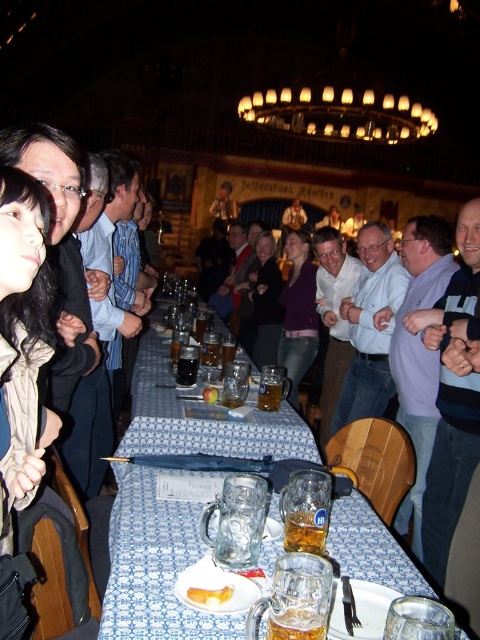
Question: Does translucent glass mug at center have a lesser width compared to translucent glass mug at lower center?

Choices:
 (A) no
 (B) yes

Answer: (B)

Question: Which object appears farthest from the camera in this image?

Choices:
 (A) clear glass mugs at center
 (B) translucent glass beer mug at table center
 (C) yellowish matte bread at lower center
 (D) translucent glass mug at center

Answer: (B)

Question: Is clear glass mugs at center closer to the viewer compared to yellowish matte bread at lower center?

Choices:
 (A) yes
 (B) no

Answer: (A)

Question: Is clear glass mugs at center wider than translucent glass beer mug at table center?

Choices:
 (A) yes
 (B) no

Answer: (A)

Question: Which point is closer to the camera?

Choices:
 (A) clear glass mugs at center
 (B) yellowish matte bread at lower center
 (C) translucent glass mug at center

Answer: (A)

Question: Which point appears farthest from the camera in this image?

Choices:
 (A) (216, 600)
 (B) (342, 538)
 (C) (320, 550)
 (D) (212, 396)

Answer: (D)